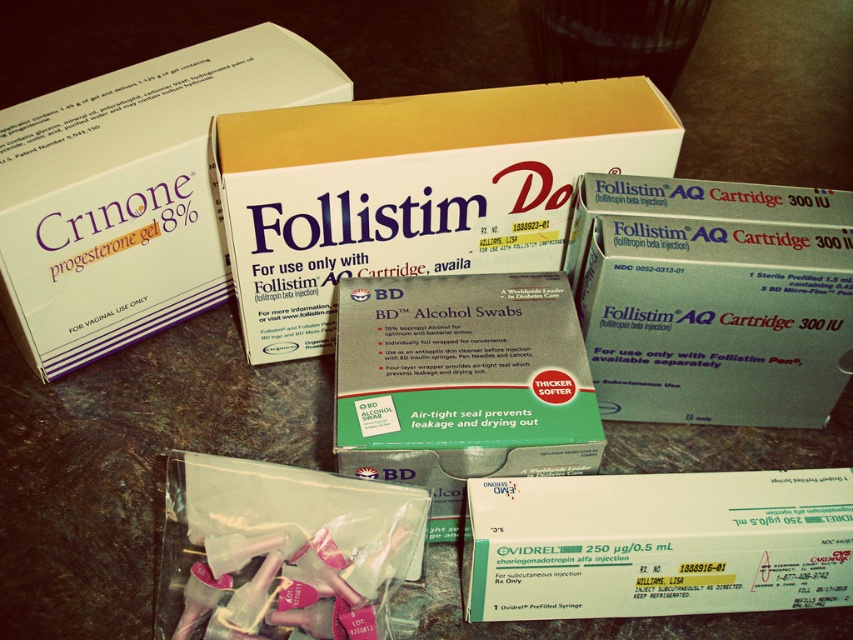
Does white cardboard box at center appear on the left side of green foil-wrapped alcohol swabs at center?

Yes, white cardboard box at center is to the left of green foil-wrapped alcohol swabs at center.

You are a GUI agent. You are given a task and a screenshot of the screen. Output one action in this format:
    pyautogui.click(x=<x>, y=<y>)
    Task: Click on the white cardboard box at center
    This screenshot has height=640, width=853.
    Given the screenshot: What is the action you would take?
    pyautogui.click(x=413, y=189)

Between white cardboard box at upper left and green cardboard box at center, which one appears on the right side from the viewer's perspective?

green cardboard box at center is more to the right.

Which of these two, white cardboard box at upper left or green cardboard box at center, stands taller?

white cardboard box at upper left is taller.

Is point (9, 285) more distant than point (782, 579)?

Yes, point (9, 285) is behind point (782, 579).

Where is `white cardboard box at upper left`? white cardboard box at upper left is located at coordinates pos(131,192).

Which of these two, green cardboard box at center or green foil-wrapped alcohol swabs at center, stands taller?

With more height is green foil-wrapped alcohol swabs at center.

Is green cardboard box at center thinner than green foil-wrapped alcohol swabs at center?

No, green cardboard box at center is not thinner than green foil-wrapped alcohol swabs at center.

At what (x,y) coordinates should I click in order to perform the action: click on green cardboard box at center. Please return your answer as a coordinate pair (x, y). The width and height of the screenshot is (853, 640). Looking at the image, I should click on (656, 544).